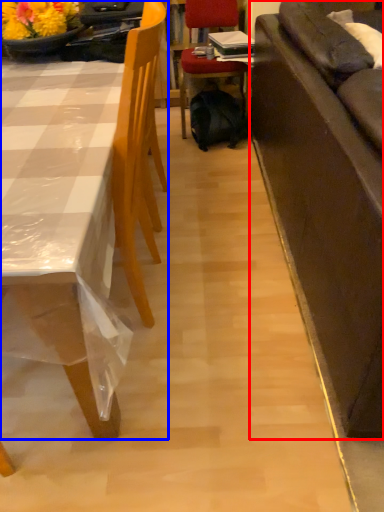
Question: Which of the following is the closest to the observer, studio couch (highlighted by a red box) or chair (highlighted by a blue box)?

Choices:
 (A) studio couch
 (B) chair

Answer: (A)